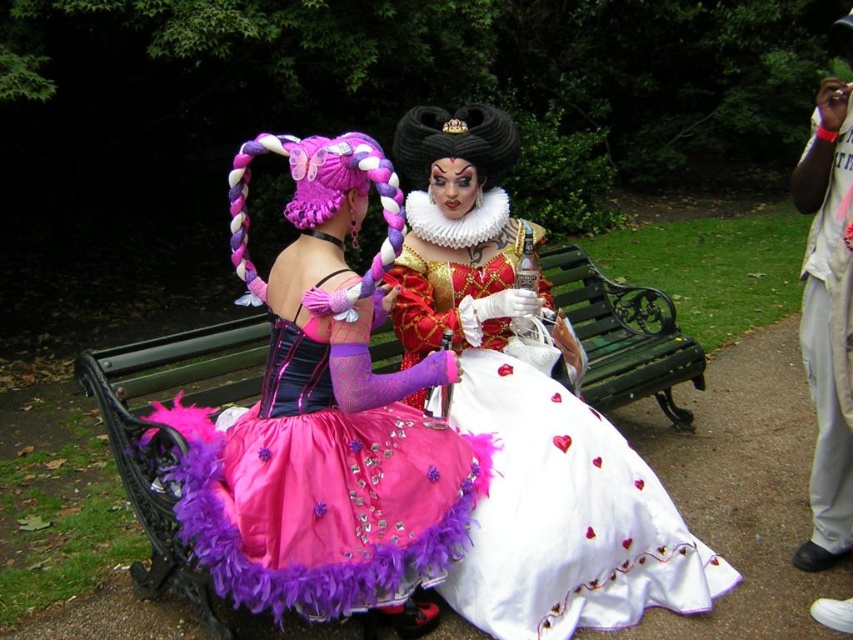
Question: Which object appears closest to the camera in this image?

Choices:
 (A) purple feathered dress at center
 (B) white satin dress at center
 (C) green wooden bench at center

Answer: (A)

Question: Does white satin dress at center have a larger size compared to green wooden bench at center?

Choices:
 (A) yes
 (B) no

Answer: (B)

Question: Can you confirm if purple feathered dress at center is smaller than green wooden bench at center?

Choices:
 (A) yes
 (B) no

Answer: (B)

Question: Which object is closer to the camera taking this photo?

Choices:
 (A) white satin dress at center
 (B) purple feathered dress at center
 (C) green wooden bench at center

Answer: (B)

Question: Which object is positioned closest to the purple feathered dress at center?

Choices:
 (A) white satin dress at center
 (B) green wooden bench at center

Answer: (A)

Question: In this image, where is purple feathered dress at center located relative to white satin dress at center?

Choices:
 (A) left
 (B) right

Answer: (A)